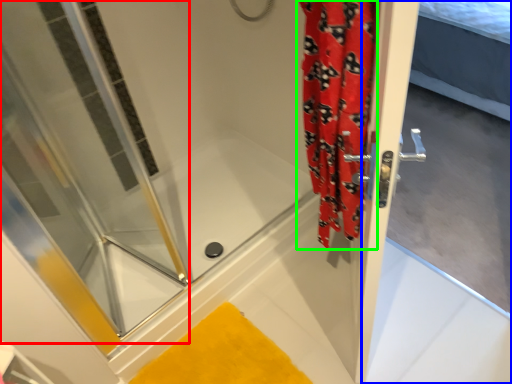
Question: Which is farther away from shower door (highlighted by a red box)? screen door (highlighted by a blue box) or shower curtain (highlighted by a green box)?

Choices:
 (A) screen door
 (B) shower curtain

Answer: (A)